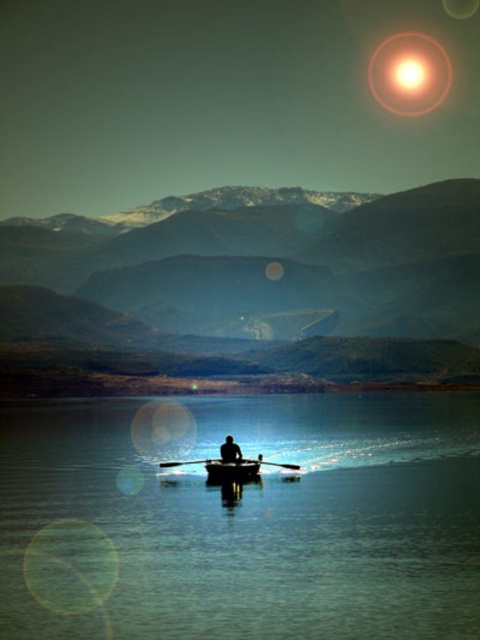
Between point (415, 432) and point (247, 461), which one is positioned in front?

Point (247, 461) is more forward.

Which is more to the left, transparent blue water at center or wooden canoe at center?

From the viewer's perspective, wooden canoe at center appears more on the left side.

You are a GUI agent. You are given a task and a screenshot of the screen. Output one action in this format:
    pyautogui.click(x=<x>, y=<y>)
    Task: Click on the transparent blue water at center
    This screenshot has width=480, height=640.
    Given the screenshot: What is the action you would take?
    pyautogui.click(x=243, y=522)

Between black plastic paddle at center and black matte person at center, which one appears on the left side from the viewer's perspective?

From the viewer's perspective, black plastic paddle at center appears more on the left side.

Does black plastic paddle at center appear on the right side of black matte person at center?

Incorrect, black plastic paddle at center is not on the right side of black matte person at center.

Locate an element on the screen. black plastic paddle at center is located at coordinates [230, 461].

Find the location of a particular element. black plastic paddle at center is located at coordinates (230, 461).

From the picture: Can you confirm if wooden canoe at center is positioned to the right of black plastic paddle at center?

Indeed, wooden canoe at center is positioned on the right side of black plastic paddle at center.

The width and height of the screenshot is (480, 640). What do you see at coordinates (231, 468) in the screenshot? I see `wooden canoe at center` at bounding box center [231, 468].

Is point (220, 477) closer to camera compared to point (168, 461)?

That is True.

This screenshot has height=640, width=480. What are the coordinates of `wooden canoe at center` in the screenshot? It's located at (231, 468).